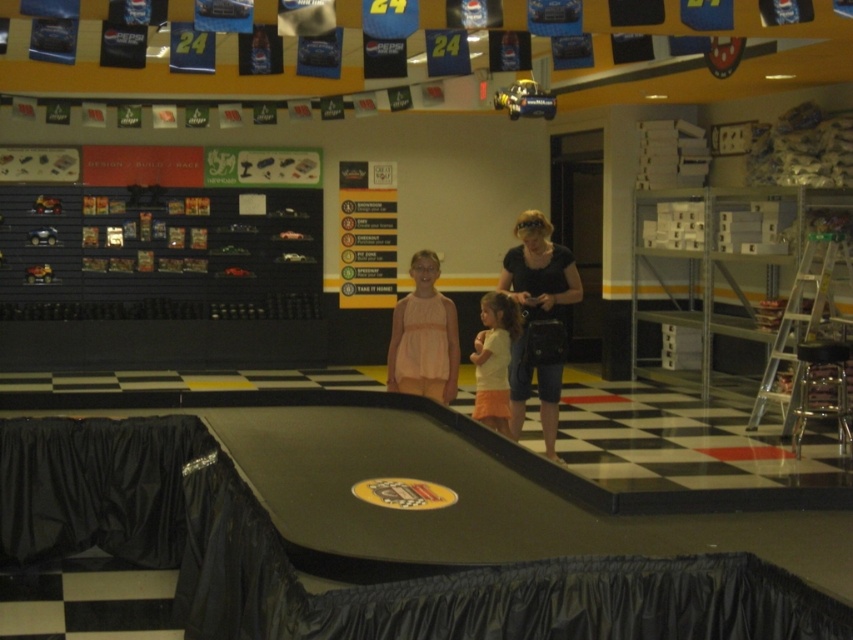
Who is positioned more to the right, pink fabric dress at center or light yellow t-shirt at center?

Positioned to the right is light yellow t-shirt at center.

Does pink fabric dress at center appear on the left side of light yellow t-shirt at center?

Yes, pink fabric dress at center is to the left of light yellow t-shirt at center.

Between point (402, 356) and point (502, 396), which one is positioned in front?

Positioned in front is point (402, 356).

The image size is (853, 640). Identify the location of pink fabric dress at center. (422, 337).

Is black fabric purse at center to the right of pink fabric dress at center from the viewer's perspective?

Correct, you'll find black fabric purse at center to the right of pink fabric dress at center.

Consider the image. Is black fabric purse at center behind pink fabric dress at center?

Yes, it is.

I want to click on black fabric purse at center, so click(538, 317).

Does black fabric purse at center have a greater width compared to light yellow t-shirt at center?

Yes, black fabric purse at center is wider than light yellow t-shirt at center.

Who is positioned more to the left, black fabric purse at center or light yellow t-shirt at center?

From the viewer's perspective, light yellow t-shirt at center appears more on the left side.

Between point (508, 275) and point (498, 432), which one is positioned in front?

Point (498, 432) is more forward.

Identify the location of black fabric purse at center. (538, 317).